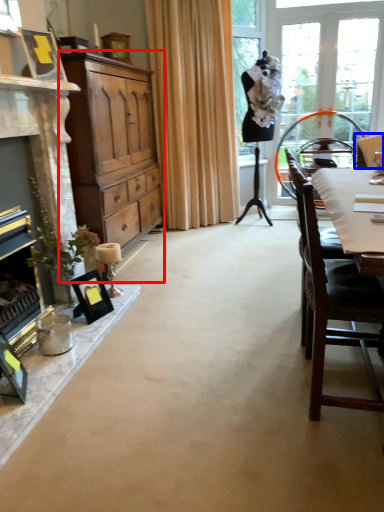
Question: Which point is closer to the camera, cabinetry (highlighted by a red box) or chair (highlighted by a blue box)?

Choices:
 (A) cabinetry
 (B) chair

Answer: (A)